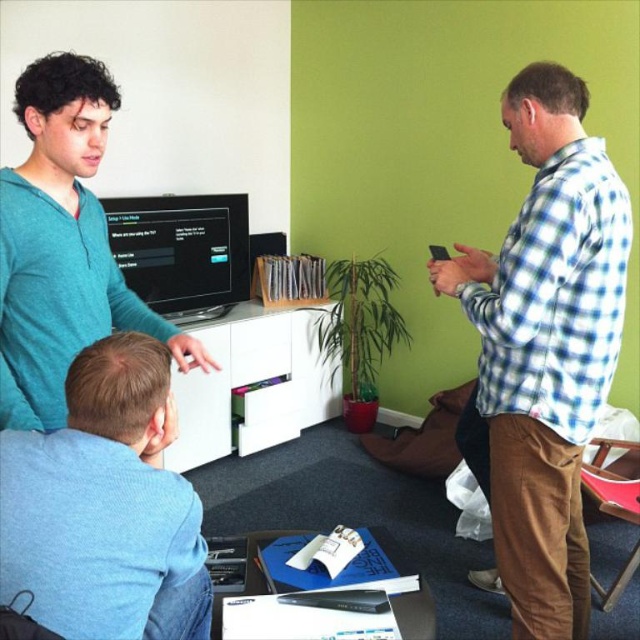
Question: Which point is farther to the camera?

Choices:
 (A) black glossy monitor at center
 (B) teal soft sweater at upper left
 (C) blue checkered shirt at right
 (D) light blue cotton shirt at lower left

Answer: (A)

Question: Does blue checkered shirt at right have a greater width compared to teal soft sweater at upper left?

Choices:
 (A) yes
 (B) no

Answer: (A)

Question: Is blue checkered shirt at right thinner than black glossy monitor at center?

Choices:
 (A) no
 (B) yes

Answer: (B)

Question: Is blue checkered shirt at right smaller than teal soft sweater at upper left?

Choices:
 (A) yes
 (B) no

Answer: (B)

Question: Considering the real-world distances, which object is closest to the light blue cotton shirt at lower left?

Choices:
 (A) teal soft sweater at upper left
 (B) blue checkered shirt at right

Answer: (A)

Question: Which of these objects is positioned closest to the black glossy monitor at center?

Choices:
 (A) teal soft sweater at upper left
 (B) blue checkered shirt at right
 (C) light blue cotton shirt at lower left

Answer: (A)